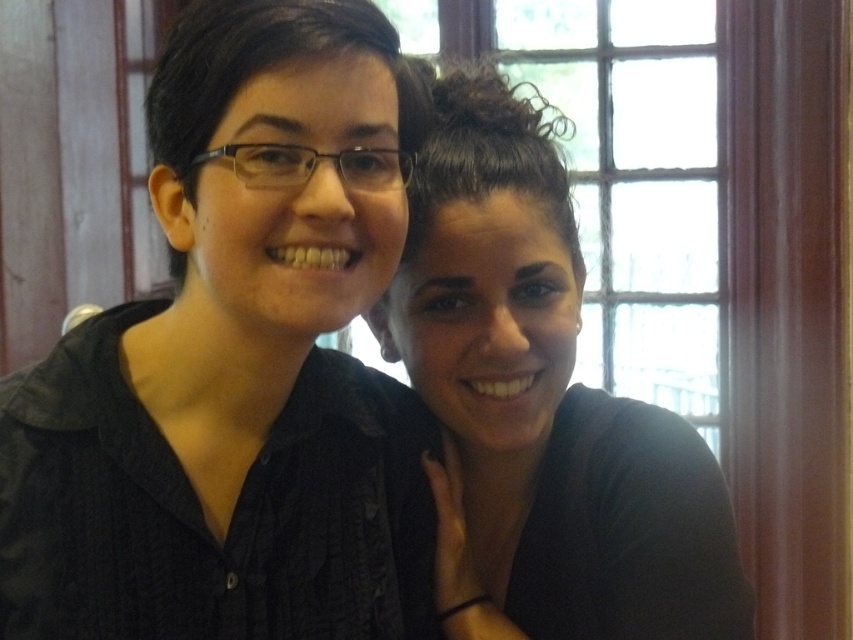
Who is more distant from viewer, [221,168] or [537,186]?

Point [537,186]

Can you confirm if black matte shirt at center is positioned below matte black shirt at center?

Incorrect, black matte shirt at center is not positioned below matte black shirt at center.

What do you see at coordinates (236, 364) in the screenshot? The width and height of the screenshot is (853, 640). I see `black matte shirt at center` at bounding box center [236, 364].

What are the coordinates of `black matte shirt at center` in the screenshot? It's located at (236, 364).